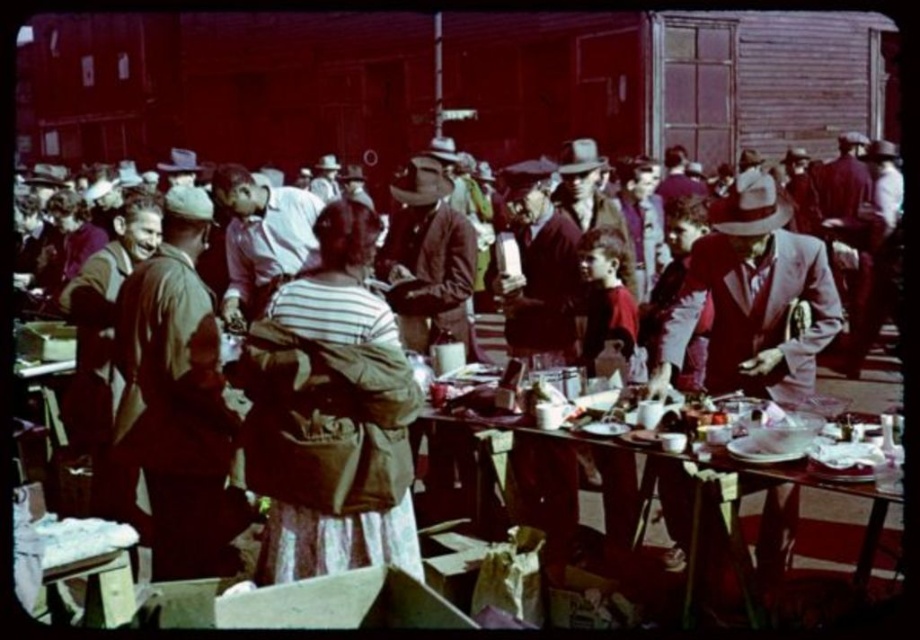
Question: Is brown leather jacket at center to the left of matte pink shirt at center from the viewer's perspective?

Choices:
 (A) yes
 (B) no

Answer: (B)

Question: Does matte brown suit at center lie behind wooden table at center?

Choices:
 (A) yes
 (B) no

Answer: (A)

Question: Considering the real-world distances, which object is closest to the striped fabric jacket at center?

Choices:
 (A) light purple wool suit at center
 (B) matte brown suit at center
 (C) wooden table at center

Answer: (A)

Question: Which point is farther from the camera taking this photo?

Choices:
 (A) (389, 522)
 (B) (529, 515)

Answer: (B)

Question: Estimate the real-world distances between objects in this image. Which object is closer to the striped fabric jacket at center?

Choices:
 (A) light purple wool suit at center
 (B) matte brown suit at center
 (C) brown leather jacket at left

Answer: (C)

Question: Observing the image, what is the correct spatial positioning of brown leather jacket at left in reference to matte brown suit at center?

Choices:
 (A) below
 (B) above

Answer: (A)